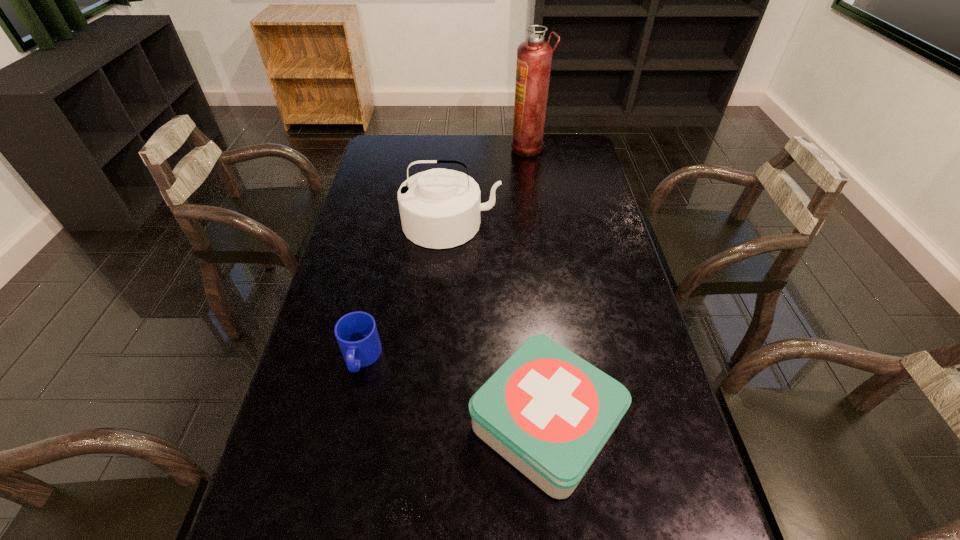
Identify the location of free space between the fire extinguisher and the second farthest object. The image size is (960, 540). (490, 186).

Where is `free space between the tallest object and the first-aid kit`? The image size is (960, 540). free space between the tallest object and the first-aid kit is located at coordinates (537, 286).

Identify the location of vacant point located between the mug and the fire extinguisher. Image resolution: width=960 pixels, height=540 pixels. (444, 253).

In order to click on free space between the mug and the farthest object in this screenshot , I will do `click(444, 253)`.

The height and width of the screenshot is (540, 960). In order to click on vacant region between the first-aid kit and the farthest object in this screenshot , I will do `click(537, 286)`.

Identify the location of empty location between the kettle and the mug. This screenshot has width=960, height=540. (406, 291).

This screenshot has width=960, height=540. Identify the location of free spot between the fire extinguisher and the kettle. (x=490, y=186).

This screenshot has width=960, height=540. I want to click on free space between the kettle and the mug, so click(406, 291).

Where is `vacant space in between the mug and the tallest object`? The image size is (960, 540). vacant space in between the mug and the tallest object is located at coordinates (444, 253).

Image resolution: width=960 pixels, height=540 pixels. Find the location of `object that is the nearest to the first-aid kit`. object that is the nearest to the first-aid kit is located at coordinates (356, 332).